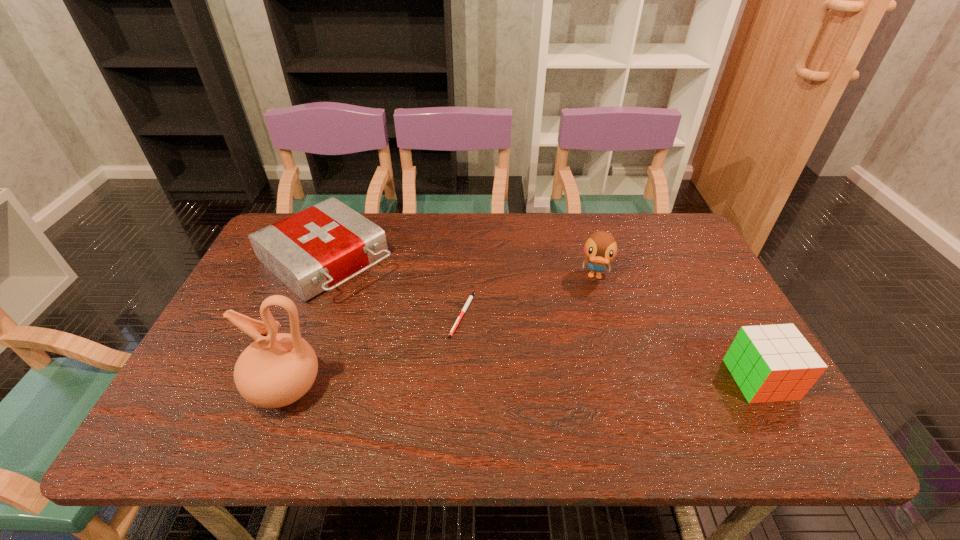
Identify the location of pottery present at the near edge. (276, 370).

Locate an element on the screen. The height and width of the screenshot is (540, 960). cube located at the near edge is located at coordinates (770, 363).

The width and height of the screenshot is (960, 540). What are the coordinates of `pottery that is at the left edge` in the screenshot? It's located at (276, 370).

Locate an element on the screen. This screenshot has height=540, width=960. the first-aid kit that is at the left edge is located at coordinates (323, 245).

Locate an element on the screen. object that is at the right edge is located at coordinates (770, 363).

Where is `object that is at the far left corner`? This screenshot has width=960, height=540. object that is at the far left corner is located at coordinates (323, 245).

This screenshot has height=540, width=960. I want to click on object positioned at the near left corner, so click(276, 370).

Where is `object at the near right corner`? object at the near right corner is located at coordinates (770, 363).

This screenshot has width=960, height=540. I want to click on vacant point at the far edge, so click(x=533, y=222).

Where is `vacant area at the near edge`? The width and height of the screenshot is (960, 540). vacant area at the near edge is located at coordinates tap(568, 375).